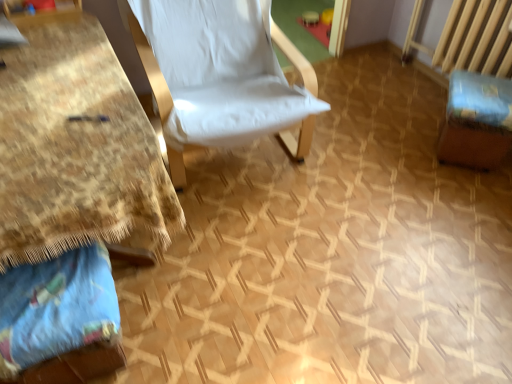
What is the approximate width of brown fabric swivel chair at right?

It is 35.50 centimeters.

You are a GUI agent. You are given a task and a screenshot of the screen. Output one action in this format:
    pyautogui.click(x=<x>, y=<y>)
    Task: Click on the white fabric chair at center
    
    Given the screenshot: What is the action you would take?
    pyautogui.click(x=233, y=100)

Between point (3, 350) and point (225, 97), which one is positioned in front?

The point (3, 350) is closer.

From the image's perspective, is blue cotton pillow at lower left positioned above or below white fabric chair at center?

blue cotton pillow at lower left is situated lower than white fabric chair at center in the image.

Based on their sizes in the image, would you say blue cotton pillow at lower left is bigger or smaller than white fabric chair at center?

Clearly, blue cotton pillow at lower left is smaller in size than white fabric chair at center.

Is blue cotton pillow at lower left not near white fabric chair at center?

blue cotton pillow at lower left is actually quite close to white fabric chair at center.

Considering the sizes of objects white fabric chair at center and wooden table at left in the image provided, who is thinner, white fabric chair at center or wooden table at left?

white fabric chair at center.

Which object is positioned more to the right, white fabric chair at center or wooden table at left?

Positioned to the right is white fabric chair at center.

Could you tell me if white fabric chair at center is facing wooden table at left?

No, white fabric chair at center is not oriented towards wooden table at left.

Which object is further away from the camera, white fabric chair at center or wooden table at left?

white fabric chair at center is more distant.

From a real-world perspective, which object rests below the other?

blue cotton pillow at lower left, from a real-world perspective.

Can you confirm if blue cotton pillow at lower left is positioned to the right of brown fabric swivel chair at right?

In fact, blue cotton pillow at lower left is to the left of brown fabric swivel chair at right.

Is blue cotton pillow at lower left wider than brown fabric swivel chair at right?

Incorrect, the width of blue cotton pillow at lower left does not surpass that of brown fabric swivel chair at right.

Between brown fabric swivel chair at right and white fabric chair at center, which one has larger width?

white fabric chair at center.

Is brown fabric swivel chair at right oriented towards white fabric chair at center?

No, brown fabric swivel chair at right is not aimed at white fabric chair at center.

Considering the sizes of objects brown fabric swivel chair at right and white fabric chair at center in the image provided, who is shorter, brown fabric swivel chair at right or white fabric chair at center?

brown fabric swivel chair at right is shorter.

From a real-world perspective, is blue cotton pillow at lower left beneath wooden table at left?

Correct, in the physical world, blue cotton pillow at lower left is lower than wooden table at left.

Is blue cotton pillow at lower left in contact with wooden table at left?

They are not placed beside each other.

Considering the positions of objects white fabric chair at center and blue cotton pillow at lower left in the image provided, who is more to the left, white fabric chair at center or blue cotton pillow at lower left?

blue cotton pillow at lower left.

In the scene shown: From the image's perspective, relative to blue cotton pillow at lower left, is white fabric chair at center above or below?

white fabric chair at center is situated higher than blue cotton pillow at lower left in the image.

Can you confirm if white fabric chair at center is bigger than blue cotton pillow at lower left?

Correct, white fabric chair at center is larger in size than blue cotton pillow at lower left.

Locate an element on the screen. fabric that appears below the white fabric chair at center (from the image's perspective) is located at coordinates (57, 308).

Considering the relative positions of wooden table at left and brown fabric swivel chair at right in the image provided, is wooden table at left to the left of brown fabric swivel chair at right from the viewer's perspective?

Correct, you'll find wooden table at left to the left of brown fabric swivel chair at right.

How much distance is there between wooden table at left and brown fabric swivel chair at right?

wooden table at left is 1.48 meters from brown fabric swivel chair at right.

Based on the photo, could you tell me if wooden table at left is facing brown fabric swivel chair at right?

No, wooden table at left is not facing towards brown fabric swivel chair at right.

Looking at this image, from a real-world perspective, is wooden table at left physically located above or below brown fabric swivel chair at right?

In terms of real-world spatial position, wooden table at left is above brown fabric swivel chair at right.

There is a blue cotton pillow at lower left. At what (x,y) coordinates should I click in order to perform the action: click on chair above it (from a real-world perspective). Please return your answer as a coordinate pair (x, y). This screenshot has width=512, height=384. Looking at the image, I should click on (233, 100).

Locate an element on the screen. This screenshot has height=384, width=512. chair behind the wooden table at left is located at coordinates (233, 100).

Looking at the image, which one is located further to wooden table at left, brown fabric swivel chair at right or blue cotton pillow at lower left?

brown fabric swivel chair at right is further to wooden table at left.

Based on the photo, when comparing their distances from blue cotton pillow at lower left, does white fabric chair at center or wooden table at left seem closer?

The object closer to blue cotton pillow at lower left is wooden table at left.

Which object lies further to the anchor point brown fabric swivel chair at right, wooden table at left or white fabric chair at center?

Based on the image, wooden table at left appears to be further to brown fabric swivel chair at right.

Which object lies nearer to the anchor point white fabric chair at center, wooden table at left or brown fabric swivel chair at right?

wooden table at left lies closer to white fabric chair at center than the other object.

Based on their spatial positions, is brown fabric swivel chair at right or wooden table at left closer to blue cotton pillow at lower left?

Based on the image, wooden table at left appears to be nearer to blue cotton pillow at lower left.

Considering their positions, is blue cotton pillow at lower left positioned closer to white fabric chair at center than wooden table at left?

The object closer to white fabric chair at center is wooden table at left.

Which object lies nearer to the anchor point blue cotton pillow at lower left, white fabric chair at center or brown fabric swivel chair at right?

Based on the image, white fabric chair at center appears to be nearer to blue cotton pillow at lower left.

Looking at the image, which one is located further to brown fabric swivel chair at right, white fabric chair at center or wooden table at left?

Among the two, wooden table at left is located further to brown fabric swivel chair at right.

The width and height of the screenshot is (512, 384). I want to click on table between white fabric chair at center and blue cotton pillow at lower left in the vertical direction, so pos(75,148).

You are a GUI agent. You are given a task and a screenshot of the screen. Output one action in this format:
    pyautogui.click(x=<x>, y=<y>)
    Task: Click on the chair between blue cotton pillow at lower left and brown fabric swivel chair at right from left to right
    
    Given the screenshot: What is the action you would take?
    pyautogui.click(x=233, y=100)

The width and height of the screenshot is (512, 384). Identify the location of chair situated between wooden table at left and brown fabric swivel chair at right from left to right. (233, 100).

Locate an element on the screen. The width and height of the screenshot is (512, 384). fabric situated between wooden table at left and brown fabric swivel chair at right from left to right is located at coordinates (57, 308).